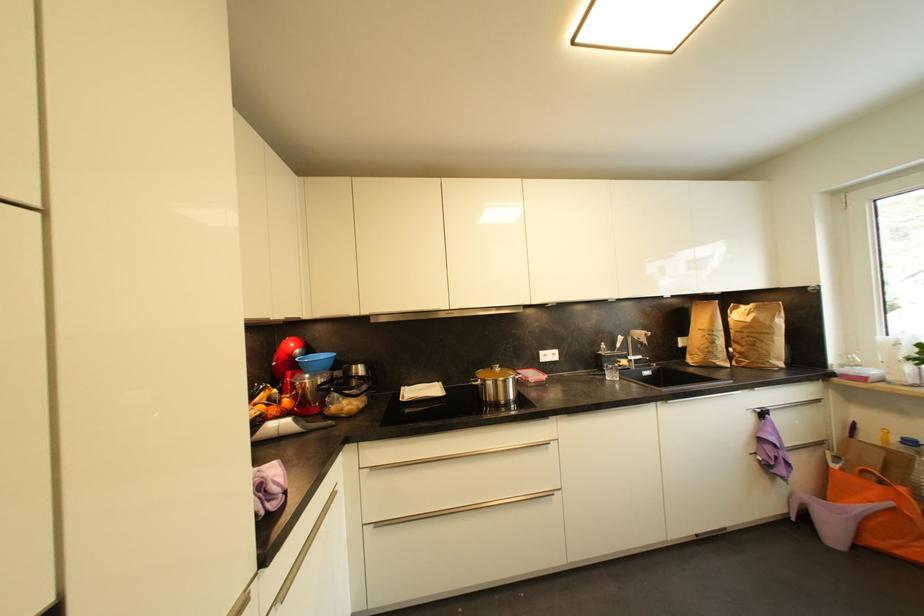
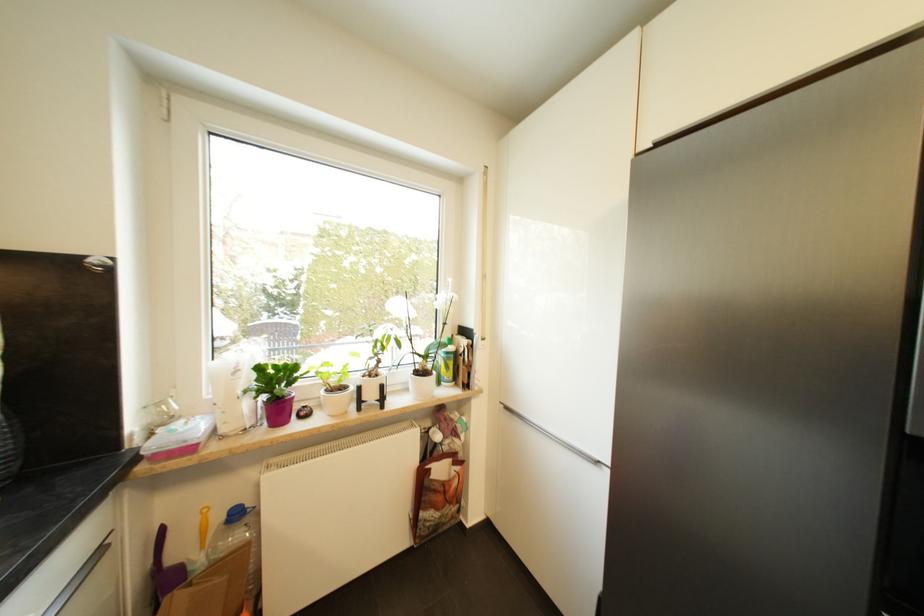
Locate, in the second image, the point that corresponds to pixel 885 426 in the first image.

(207, 507)